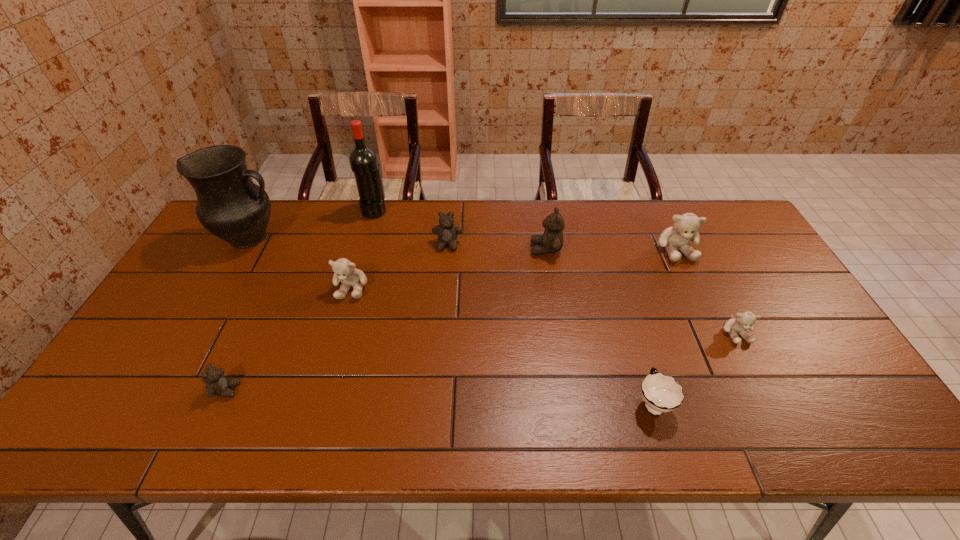
At what (x,y) coordinates should I click in order to perform the action: click on free space located 0.360m on the face of the fourth teddy bear from left to right. Please return your answer as a coordinate pair (x, y). The image size is (960, 540). Looking at the image, I should click on (419, 249).

Locate an element on the screen. This screenshot has height=540, width=960. blank area located 0.250m on the face of the biggest gray teddy bear is located at coordinates (714, 329).

Where is `vacant region located on the face of the second smallest brown teddy bear`? vacant region located on the face of the second smallest brown teddy bear is located at coordinates (444, 281).

The width and height of the screenshot is (960, 540). Identify the location of free location located on the face of the fifth teddy bear from right to left. (329, 365).

Locate an element on the screen. vacant position located 0.320m on the face of the nearest brown teddy bear is located at coordinates (372, 390).

Locate an element on the screen. This screenshot has width=960, height=540. free region located 0.060m on the face of the fifth farthest teddy bear is located at coordinates (753, 366).

Where is `vacant space located on the side of the shortest object with the handle`? This screenshot has width=960, height=540. vacant space located on the side of the shortest object with the handle is located at coordinates (618, 289).

Where is `vacant space located 0.170m on the side of the shortest object with the handle`? This screenshot has width=960, height=540. vacant space located 0.170m on the side of the shortest object with the handle is located at coordinates (630, 326).

Where is `free spot located on the side of the shortest object with the handle`? The height and width of the screenshot is (540, 960). free spot located on the side of the shortest object with the handle is located at coordinates (634, 341).

The width and height of the screenshot is (960, 540). What are the coordinates of `wine bottle situated at the far edge` in the screenshot? It's located at (363, 161).